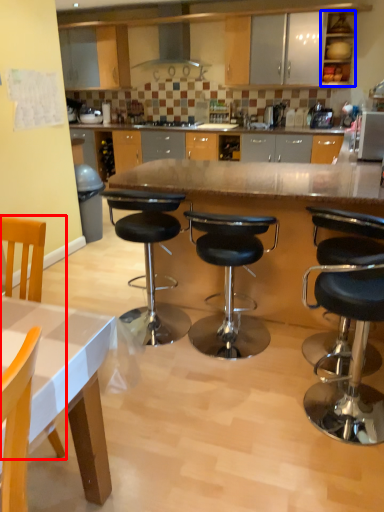
Question: Among these objects, which one is nearest to the camera, chair (highlighted by a red box) or cabinetry (highlighted by a blue box)?

Choices:
 (A) chair
 (B) cabinetry

Answer: (A)